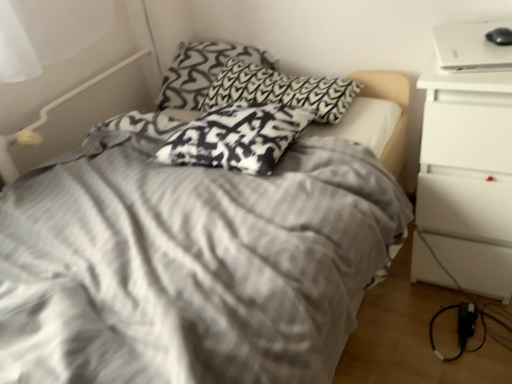
Identify the location of free space underneath white glossy laptop at upper right (from a real-world perspective). The width and height of the screenshot is (512, 384). (481, 46).